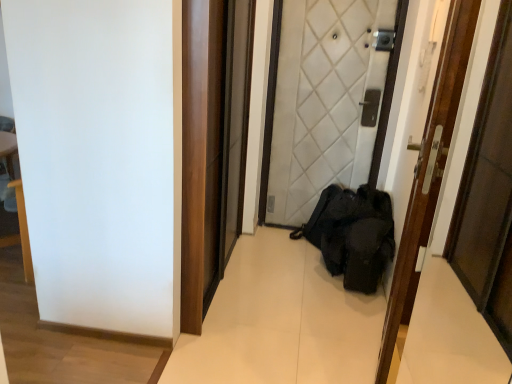
I want to click on vacant area that lies in front of white quilted fabric door at center, the 1th door when ordered from back to front, so click(x=295, y=264).